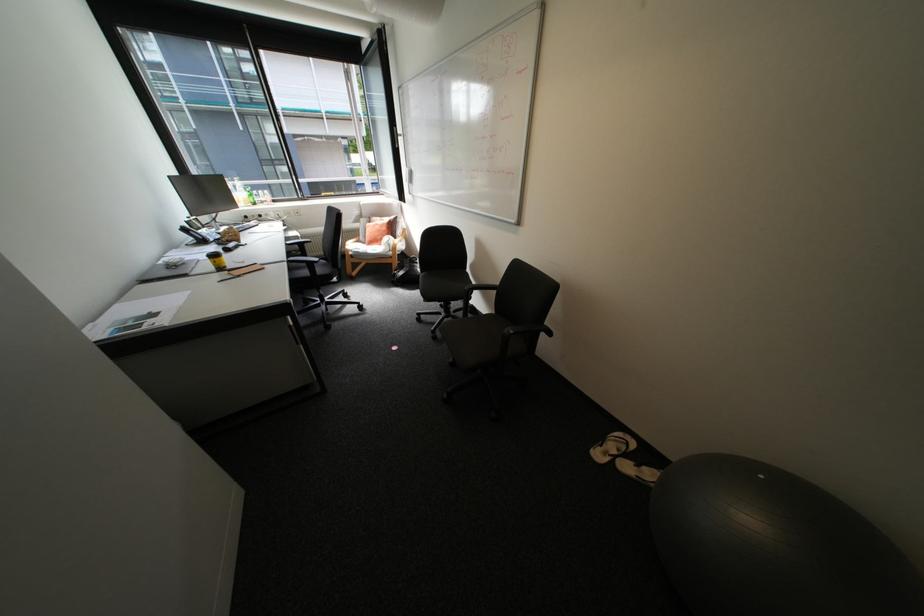
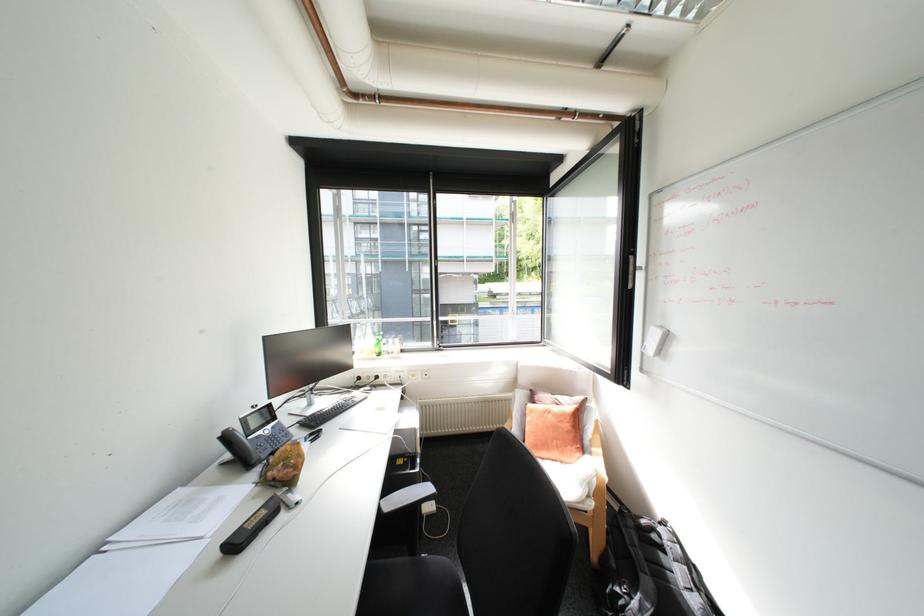
The point at (386,225) is marked in the first image. Where is the corresponding point in the second image?

(561, 416)